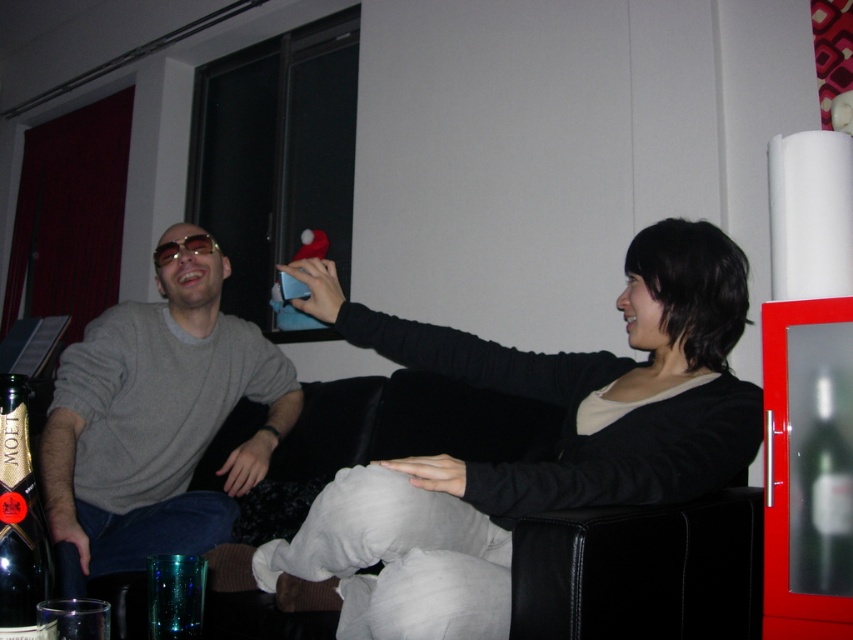
Question: Can you confirm if matte gray sweater at center is smaller than translucent glass bottle at right?

Choices:
 (A) no
 (B) yes

Answer: (A)

Question: Which point is farther to the camera?

Choices:
 (A) translucent glass bottle at right
 (B) matte gray sweater at center
 (C) matte black sweater at center
 (D) dark glass bottle at lower left

Answer: (B)

Question: Which object appears closest to the camera in this image?

Choices:
 (A) matte gray sweater at center
 (B) matte black sweater at center

Answer: (B)

Question: Does matte gray sweater at center appear on the right side of translucent glass cup at lower left?

Choices:
 (A) no
 (B) yes

Answer: (A)

Question: Does dark glass bottle at lower left come in front of translucent glass bottle at right?

Choices:
 (A) no
 (B) yes

Answer: (B)

Question: Which object is closer to the camera taking this photo?

Choices:
 (A) matte gray sweater at center
 (B) matte black sweater at center
 (C) translucent glass cup at lower left
 (D) translucent glass bottle at right

Answer: (C)